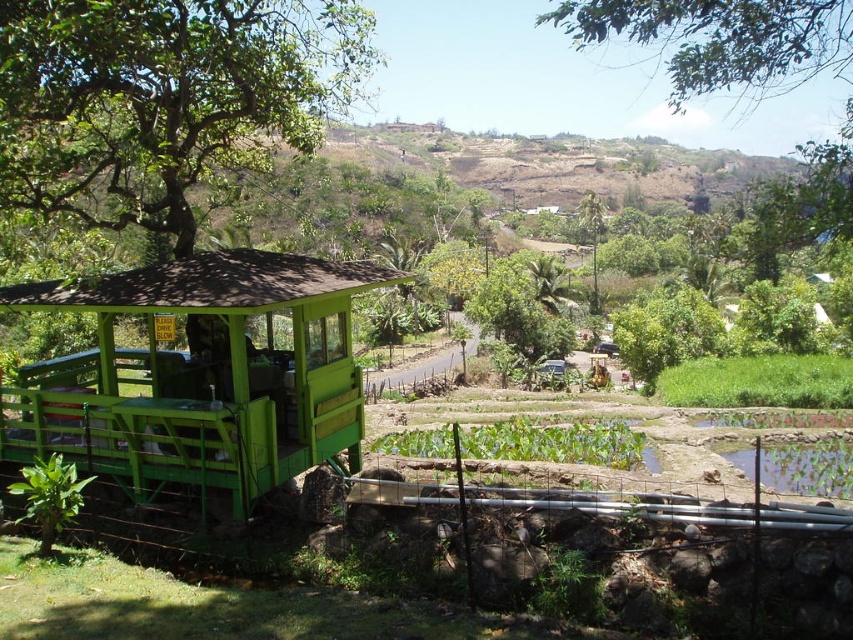
You are a drone operator trying to capture a photo of the green leafy tree at upper left and the green matte gazebo at center. From your current position, which object is higher in the frame?

The green leafy tree at upper left is located above the green matte gazebo at center, so it is higher in the frame.

You are a photographer standing at the edge of the grassy area. You want to take a photo of the green matte gazebo at center and the green leafy tree at upper center. Based on their positions, which object will appear closer to the camera in the photo?

The green matte gazebo at center will appear closer to the camera in the photo because it is positioned in front of the green leafy tree at upper center.

Based on the scene description, where is the green leafy tree at upper left located in terms of coordinates?

The green leafy tree at upper left is located at coordinates point (164, 99).